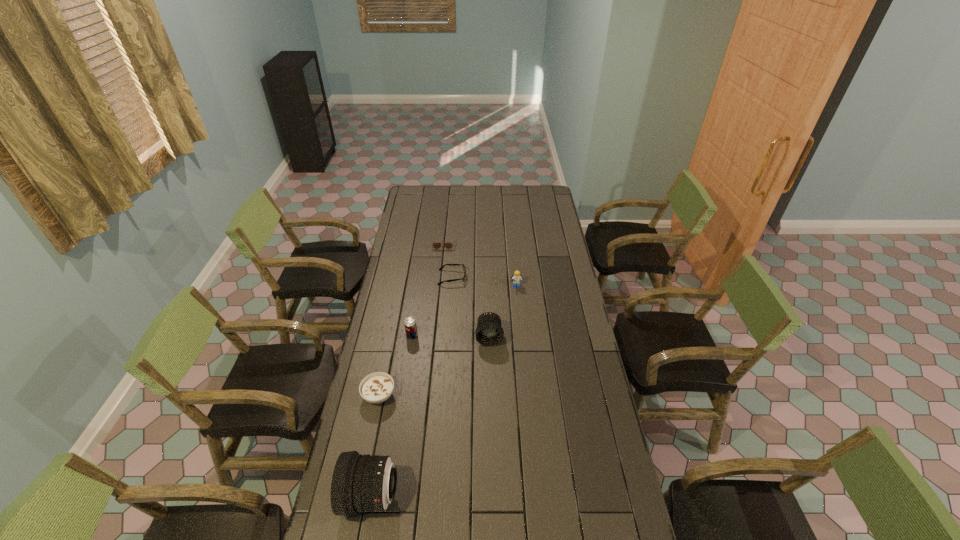
Image resolution: width=960 pixels, height=540 pixels. In order to click on object that is positioned at the near left corner in this screenshot , I will do `click(361, 483)`.

In the image, there is a desktop. Find the location of `vacant region at the far edge`. vacant region at the far edge is located at coordinates (448, 205).

You are a GUI agent. You are given a task and a screenshot of the screen. Output one action in this format:
    pyautogui.click(x=<x>, y=<y>)
    Task: Click on the vacant space at the left edge of the desktop
    
    Given the screenshot: What is the action you would take?
    pyautogui.click(x=406, y=241)

At what (x,y) coordinates should I click in order to perform the action: click on vacant space at the right edge of the desktop. Please return your answer as a coordinate pair (x, y). Looking at the image, I should click on (602, 473).

This screenshot has width=960, height=540. Find the location of `free spot at the far right corner of the desktop`. free spot at the far right corner of the desktop is located at coordinates (556, 205).

Image resolution: width=960 pixels, height=540 pixels. In order to click on free space between the sixth object from left to right and the spectacles in this screenshot , I will do `click(470, 307)`.

You are a GUI agent. You are given a task and a screenshot of the screen. Output one action in this format:
    pyautogui.click(x=<x>, y=<y>)
    Task: Click on the free space between the farthest object and the nearer telephoto lens
    The width and height of the screenshot is (960, 540).
    Given the screenshot: What is the action you would take?
    pyautogui.click(x=408, y=369)

The image size is (960, 540). In order to click on vacant region between the farther telephoto lens and the spectacles in this screenshot , I will do [x=470, y=307].

The height and width of the screenshot is (540, 960). Identify the location of blank region between the right telephoto lens and the sunglasses. coord(467,289).

Identify the location of vacant point located between the Lego and the beer can. This screenshot has height=540, width=960. (465, 311).